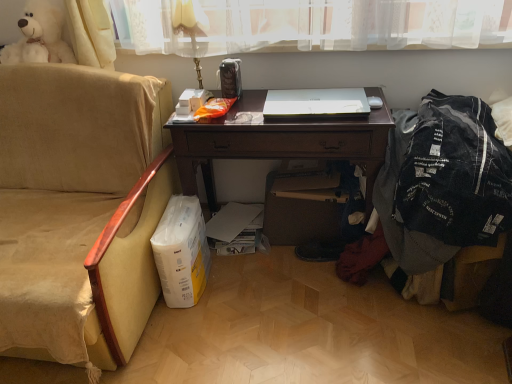
This screenshot has height=384, width=512. What do you see at coordinates (39, 36) in the screenshot?
I see `white plush bear at upper left` at bounding box center [39, 36].

I want to click on white glossy laptop at center, so 316,103.

Measure the distance between gold metallic table lamp at upper center and camera.

gold metallic table lamp at upper center is 1.65 meters from camera.

What is the approximate height of brown cardboard box at lower center?

The height of brown cardboard box at lower center is 16.38 inches.

Identify the location of white plush bear at upper left. This screenshot has width=512, height=384. (39, 36).

Is point (55, 187) in front of point (182, 2)?

That is False.

Can you confirm if beige fabric chair at left is thinner than gold metallic table lamp at upper center?

Incorrect, the width of beige fabric chair at left is not less than that of gold metallic table lamp at upper center.

Considering the positions of objects beige fabric chair at left and gold metallic table lamp at upper center in the image provided, who is more to the right, beige fabric chair at left or gold metallic table lamp at upper center?

gold metallic table lamp at upper center.

Is denim jacket at right facing towards beige fabric chair at left?

No, denim jacket at right is not turned towards beige fabric chair at left.

Between denim jacket at right and beige fabric chair at left, which one has larger size?

beige fabric chair at left.

At what (x,y) coordinates should I click in order to perform the action: click on clothing lying on the right of beige fabric chair at left. Please return your answer as a coordinate pair (x, y). Looking at the image, I should click on (455, 174).

Does denim jacket at right lie in front of beige fabric chair at left?

That is False.

Is white plush bear at upper left not near beige fabric chair at left?

white plush bear at upper left is actually quite close to beige fabric chair at left.

Between white plush bear at upper left and beige fabric chair at left, which one has smaller size?

white plush bear at upper left.

Measure the distance between white plush bear at upper left and beige fabric chair at left.

They are 22.95 inches apart.

Find the location of a particular element. The height and width of the screenshot is (384, 512). chair to the left of white plush bear at upper left is located at coordinates (78, 211).

In the scene shown: Considering the relative positions of beige fabric chair at left and dark wood desk at center in the image provided, is beige fabric chair at left to the left of dark wood desk at center from the viewer's perspective?

Yes.

Can you confirm if beige fabric chair at left is thinner than dark wood desk at center?

No.

From a real-world perspective, is beige fabric chair at left physically below dark wood desk at center?

No, from a real-world perspective, beige fabric chair at left is not below dark wood desk at center.

Which object is positioned more to the right, white glossy laptop at center or denim jacket at right?

Positioned to the right is denim jacket at right.

Which of these two, white glossy laptop at center or denim jacket at right, stands taller?

With more height is denim jacket at right.

Are white glossy laptop at center and denim jacket at right located far from each other?

That's not correct — white glossy laptop at center is a little close to denim jacket at right.

Who is smaller, white glossy laptop at center or denim jacket at right?

Smaller between the two is white glossy laptop at center.

How different are the orientations of beige fabric chair at left and denim jacket at right in degrees?

The facing directions of beige fabric chair at left and denim jacket at right are 13 degrees apart.

Which point is more forward, (x=9, y=229) or (x=474, y=112)?

The point (x=474, y=112) is more forward.

Can we say beige fabric chair at left lies outside denim jacket at right?

beige fabric chair at left lies outside denim jacket at right's area.

Which of these two, beige fabric chair at left or denim jacket at right, is thinner?

With smaller width is denim jacket at right.

How much distance is there between dark wood desk at center and gold metallic table lamp at upper center?

dark wood desk at center is 23.35 inches away from gold metallic table lamp at upper center.

Looking at this image, is dark wood desk at center thinner than gold metallic table lamp at upper center?

In fact, dark wood desk at center might be wider than gold metallic table lamp at upper center.

Based on the photo, is dark wood desk at center situated inside gold metallic table lamp at upper center or outside?

dark wood desk at center is spatially situated outside gold metallic table lamp at upper center.

From their relative heights in the image, would you say dark wood desk at center is taller or shorter than gold metallic table lamp at upper center?

Considering their sizes, dark wood desk at center has more height than gold metallic table lamp at upper center.

This screenshot has height=384, width=512. I want to click on chair below the gold metallic table lamp at upper center (from the image's perspective), so click(x=78, y=211).

Find the location of a particular element. The image size is (512, 384). chair below the denim jacket at right (from a real-world perspective) is located at coordinates (78, 211).

Which object lies nearer to the anchor point gold metallic table lamp at upper center, white plush bear at upper left or dark wood desk at center?

dark wood desk at center.

Estimate the real-world distances between objects in this image. Which object is further from gold metallic table lamp at upper center, brown cardboard box at lower center or beige fabric chair at left?

brown cardboard box at lower center.

Looking at this image, which object lies further to the anchor point beige fabric chair at left, dark wood desk at center or gold metallic table lamp at upper center?

Among the two, gold metallic table lamp at upper center is located further to beige fabric chair at left.

Estimate the real-world distances between objects in this image. Which object is closer to white glossy laptop at center, denim jacket at right or gold metallic table lamp at upper center?

denim jacket at right is positioned closer to the anchor white glossy laptop at center.

In the scene shown: Looking at the image, which one is located further to white plush bear at upper left, beige fabric chair at left or dark wood desk at center?

Based on the image, dark wood desk at center appears to be further to white plush bear at upper left.

When comparing their distances from white glossy laptop at center, does denim jacket at right or beige fabric chair at left seem further?

beige fabric chair at left.

Estimate the real-world distances between objects in this image. Which object is further from denim jacket at right, gold metallic table lamp at upper center or dark wood desk at center?

gold metallic table lamp at upper center lies further to denim jacket at right than the other object.

Looking at the image, which one is located further to denim jacket at right, white plush bear at upper left or white glossy laptop at center?

white plush bear at upper left is further to denim jacket at right.

Locate an element on the screen. Image resolution: width=512 pixels, height=384 pixels. desk between beige fabric chair at left and brown cardboard box at lower center from left to right is located at coordinates (280, 142).

Locate an element on the screen. The image size is (512, 384). laptop between beige fabric chair at left and denim jacket at right is located at coordinates (316, 103).

Locate an element on the screen. Image resolution: width=512 pixels, height=384 pixels. laptop located between dark wood desk at center and denim jacket at right in the left-right direction is located at coordinates (316, 103).

I want to click on toy between beige fabric chair at left and white glossy laptop at center in the horizontal direction, so click(39, 36).